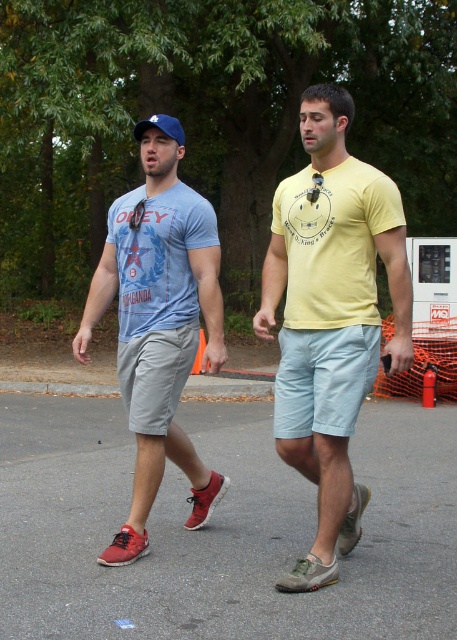
You are standing at the origin point in the image. There is a yellow matte t shirt at center represented by point (330, 316). Can you tell me the coordinates of the yellow matte t shirt at center?

The coordinates of the yellow matte t shirt at center are point (330, 316).